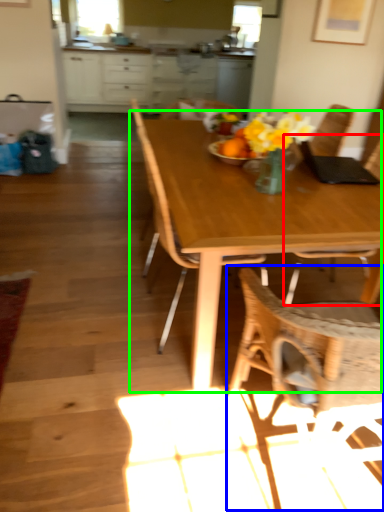
Question: Which object is positioned closest to chair (highlighted by a red box)? Select from chair (highlighted by a blue box) and kitchen & dining room table (highlighted by a green box).

Choices:
 (A) chair
 (B) kitchen & dining room table

Answer: (A)